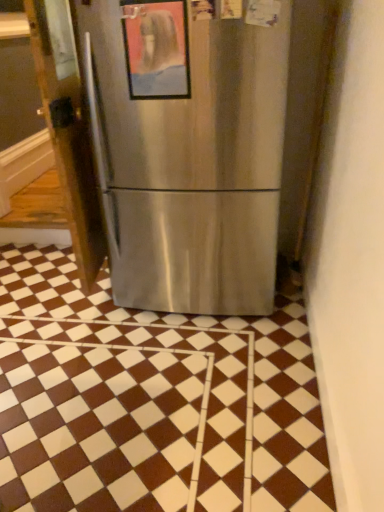
Question: Is satin silver refrigerator at left wider or thinner than brown/white checkered tile at center?

Choices:
 (A) thin
 (B) wide

Answer: (A)

Question: Would you say satin silver refrigerator at left is to the left or to the right of brown/white checkered tile at center in the picture?

Choices:
 (A) left
 (B) right

Answer: (A)

Question: Which object is the closest to the satin silver refrigerator at left?

Choices:
 (A) brown/white checkered tile at center
 (B) metallic framed picture at center

Answer: (B)

Question: Based on their relative distances, which object is nearer to the metallic framed picture at center?

Choices:
 (A) satin silver refrigerator at left
 (B) brown/white checkered tile at center

Answer: (A)